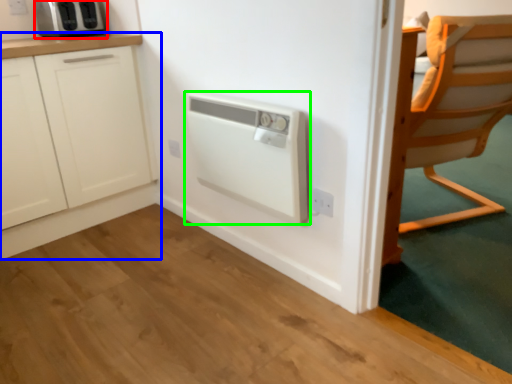
Question: Considering the real-world distances, which object is farthest from kitchen appliance (highlighted by a red box)? cabinetry (highlighted by a blue box) or home appliance (highlighted by a green box)?

Choices:
 (A) cabinetry
 (B) home appliance

Answer: (B)